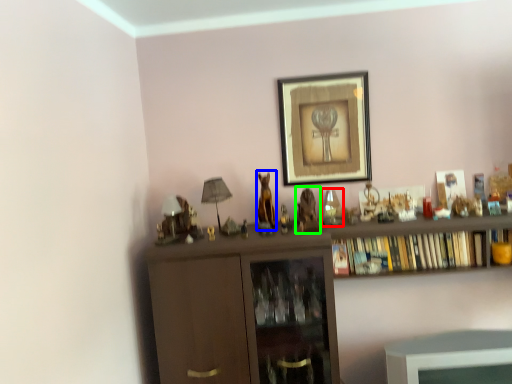
Question: Which object is the farthest from toy (highlighted by a red box)? Choose among these: animal (highlighted by a blue box) or animal (highlighted by a green box).

Choices:
 (A) animal
 (B) animal

Answer: (A)